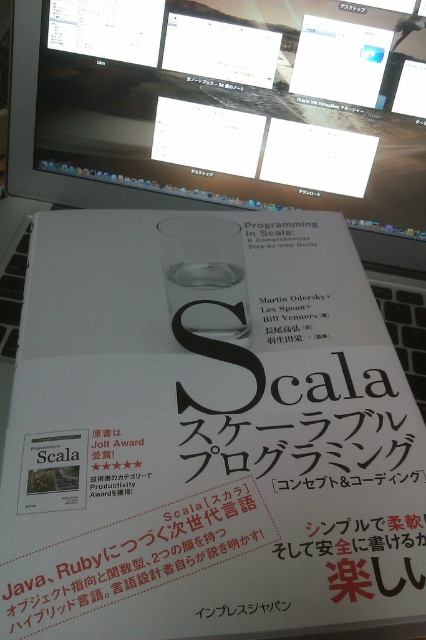
You are a graphic designer working on a layout for a book cover. You need to place a new element at the coordinates given for the matte black monitor at upper center. What are the coordinates where you should place this element?

The coordinates for the matte black monitor at upper center are at point (230, 109), so you should place the new element at those coordinates.

You are trying to place a transparent glass cup at center on the matte black monitor at upper center. Will it fit horizontally?

The matte black monitor at upper center might be wider than transparent glass cup at center, so there is a possibility that it will fit horizontally, but the exact dimensions are uncertain.